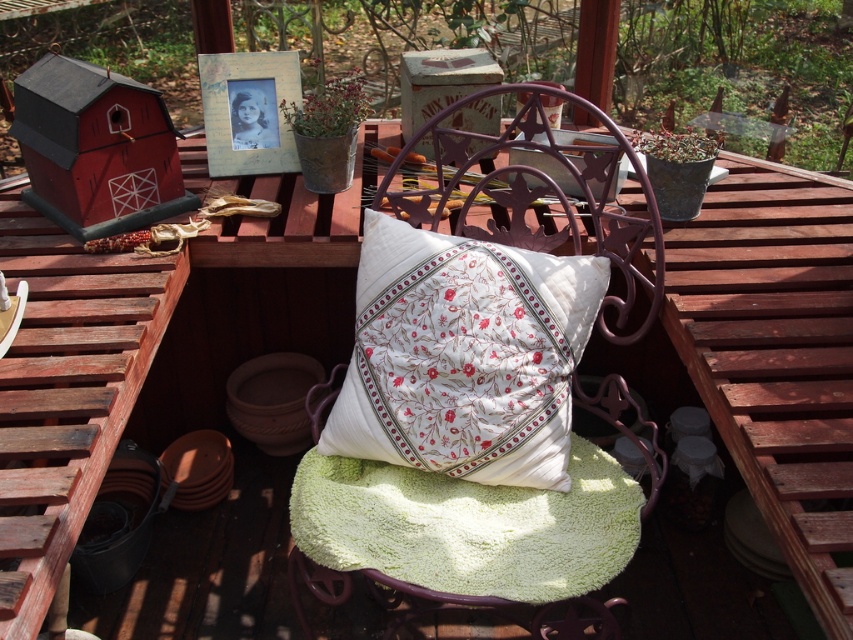
You are sitting on the purple metal chair with a green cushion and a white pillow. You want to reach for either the white cotton cushion at center or the green fluffy blanket at center. Which one can you grab without leaning forward?

The white cotton cushion at center is closer to you than the green fluffy blanket at center, so you can grab the white cotton cushion at center without leaning forward.

You are arranging a picnic on the purple metal chair with a green cushion and a white pillow. You have two cushions available, the white cotton cushion at center and the white floral cushion at center. Which cushion should you choose if you want the wider one to sit more comfortably?

The white floral cushion at center is wider than the white cotton cushion at center, so you should choose the white floral cushion at center for more comfort.

You are planning to place a new decorative pillow on the purple metal chair at center. The current items on the chair are the green fluffy blanket at center and the white floral cushion at center. Which item should you remove to make more space for the new pillow?

Since the green fluffy blanket at center occupies less space than the white floral cushion at center, you should remove the green fluffy blanket at center to make more space for the new pillow.